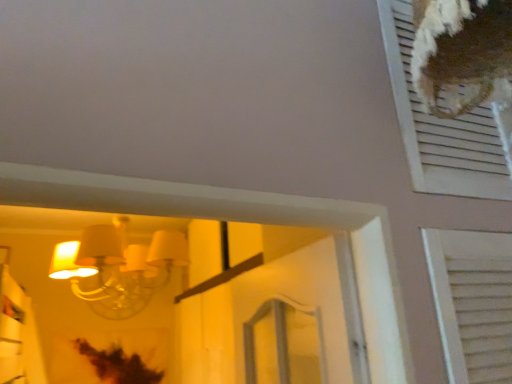
At what (x,y) coordinates should I click in order to perform the action: click on white textured vent at upper right. Please return your answer as a coordinate pair (x, y). Image resolution: width=512 pixels, height=384 pixels. Looking at the image, I should click on (441, 126).

The height and width of the screenshot is (384, 512). Describe the element at coordinates (441, 126) in the screenshot. I see `white textured vent at upper right` at that location.

In order to click on white textured vent at upper right in this screenshot , I will do `click(441, 126)`.